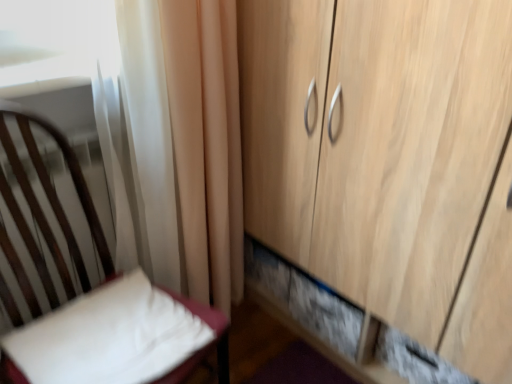
Question: From the image's perspective, relative to white soft pillow at lower left, is white sheer curtain at upper left above or below?

Choices:
 (A) above
 (B) below

Answer: (A)

Question: Is white sheer curtain at upper left taller or shorter than white soft pillow at lower left?

Choices:
 (A) tall
 (B) short

Answer: (A)

Question: Estimate the real-world distances between objects in this image. Which object is farther from the wooden cupboard at right?

Choices:
 (A) white fabric chair at left
 (B) white sheer curtain at upper left
 (C) white soft pillow at lower left

Answer: (A)

Question: Based on their relative distances, which object is nearer to the wooden cupboard at right?

Choices:
 (A) white sheer curtain at upper left
 (B) white fabric chair at left
 (C) white soft pillow at lower left

Answer: (A)